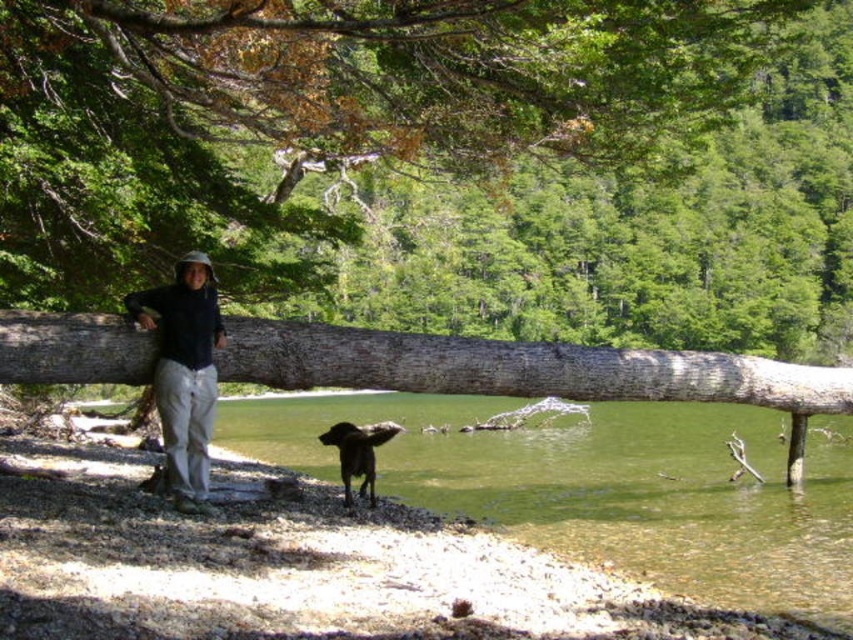
You are a hiker trying to cross a stream. You see a smooth brown log at center and a shiny brown fur at lower center. Which object is taller and can you use it to cross?

The smooth brown log at center is much taller than the shiny brown fur at lower center. Since the log is taller, it might be more stable to use as a crossing point over the stream.

You are a photographer trying to capture both the smooth brown log at center and the gray rough wood log at center in a single frame. Since you want to highlight the texture differences between them, which log should you focus on first to ensure both are in focus?

The smooth brown log at center is closer to the viewer than the gray rough wood log at center. To ensure both are in focus, focus on the gray rough wood log at center first, as it is farther away, allowing the closer log to remain sharp in the depth of field.

Based on the photo, you are standing at the location of the black matte jacket at center and want to throw a small pebble to reach the person leaning against the large fallen tree trunk. What is the minimum distance you need to throw the pebble?

The minimum distance you need to throw the pebble is 8.78 meters to reach the person leaning against the large fallen tree trunk.